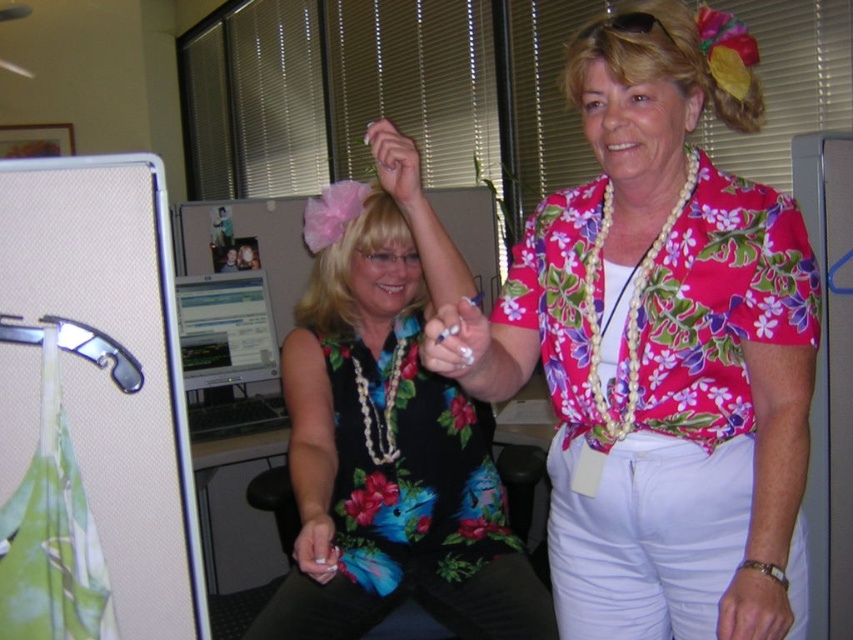
Question: Which point appears closest to the camera in this image?

Choices:
 (A) (553, 516)
 (B) (325, 563)
 (C) (718, 67)

Answer: (C)

Question: Does floral print shirt at center have a greater width compared to blonde hair at upper right?

Choices:
 (A) yes
 (B) no

Answer: (A)

Question: Based on their relative distances, which object is nearer to the blonde hair at upper right?

Choices:
 (A) matte plastic monitor at center
 (B) blondehair at center

Answer: (B)

Question: Which point is closer to the camera?

Choices:
 (A) (605, 512)
 (B) (606, 60)
 (C) (216, 438)
 (D) (434, 291)

Answer: (B)

Question: From the image, what is the correct spatial relationship of floral print shirt at center in relation to blondehair at center?

Choices:
 (A) left
 (B) right

Answer: (B)

Question: Does floral print shirt at center have a larger size compared to matte plastic monitor at center?

Choices:
 (A) no
 (B) yes

Answer: (B)